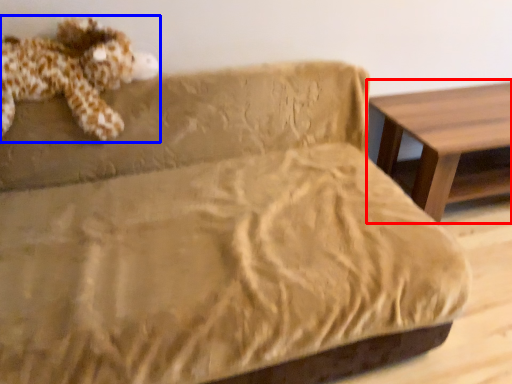
Question: Which object is further to the camera taking this photo, table (highlighted by a red box) or toy (highlighted by a blue box)?

Choices:
 (A) table
 (B) toy

Answer: (A)